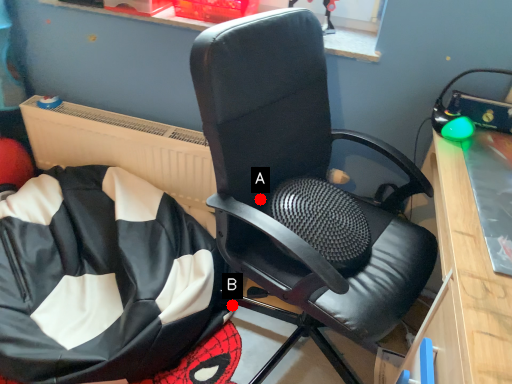
Question: Two points are circled on the image, labeled by A and B beside each circle. Which point is closer to the camera?

Choices:
 (A) A is closer
 (B) B is closer

Answer: (A)